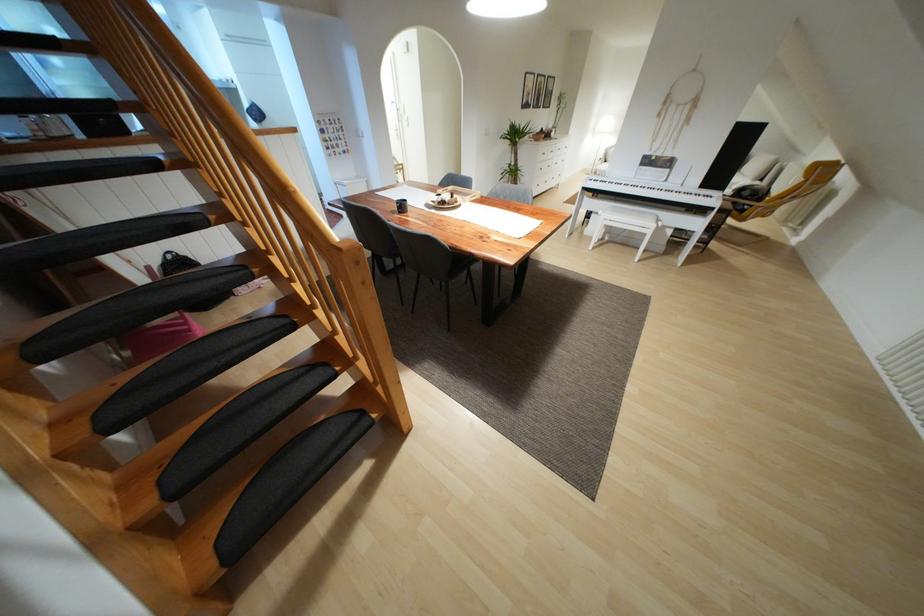
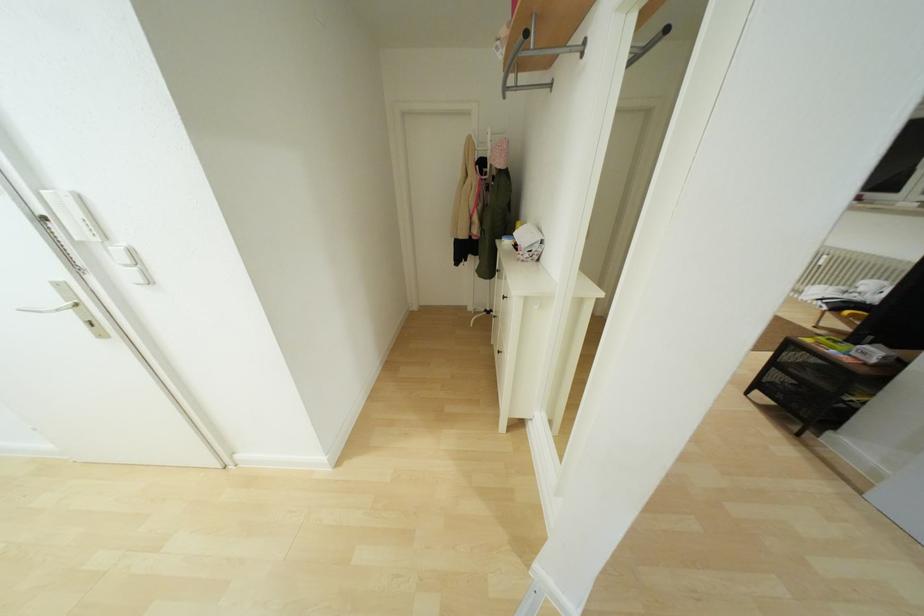
Locate, in the second image, the point that corresponds to (x=405, y=122) in the first image.

(125, 273)